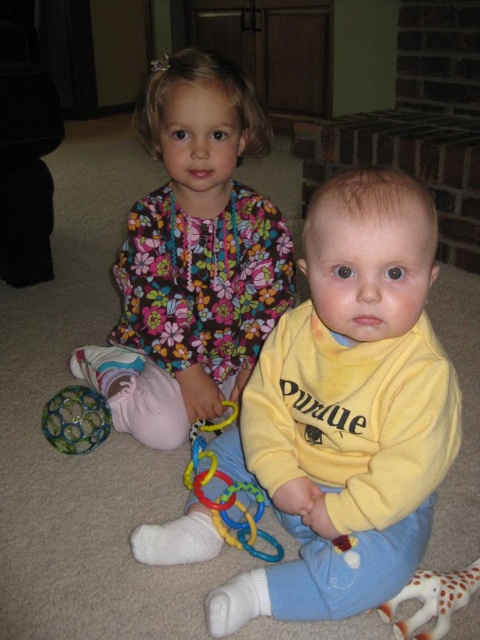
In the scene shown: You are a parent trying to locate the toys for your children. You see the point marked at coordinates (x=192, y=259). Which object is this point located on?

The point marked at coordinates (x=192, y=259) is located on the floral fabric dress at upper left.

You are a parent trying to put away toys. You have a floral fabric dress at upper left and rubber rings at center. Which item can you store in a small container that fits objects up to the size of the rubber rings?

The rubber rings at center can be stored in the small container since they are smaller than the floral fabric dress at upper left.